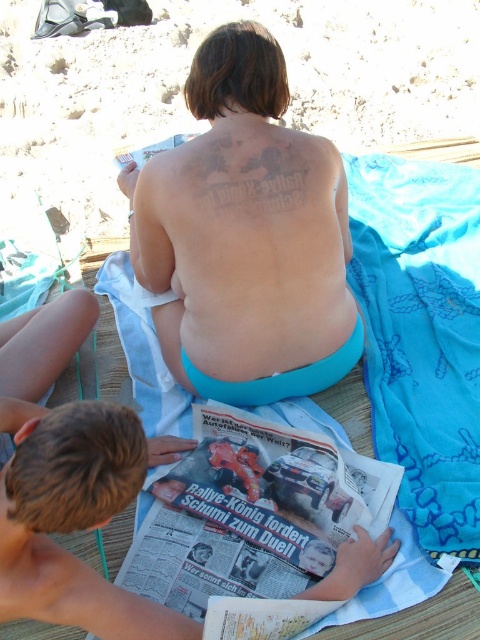
You are standing on the beach and see the skinny blue shorts at center and the blue fabric towel at center. Which object is closer to your left side?

The skinny blue shorts at center is to the left of blue fabric towel at center, so it is closer to your left side.